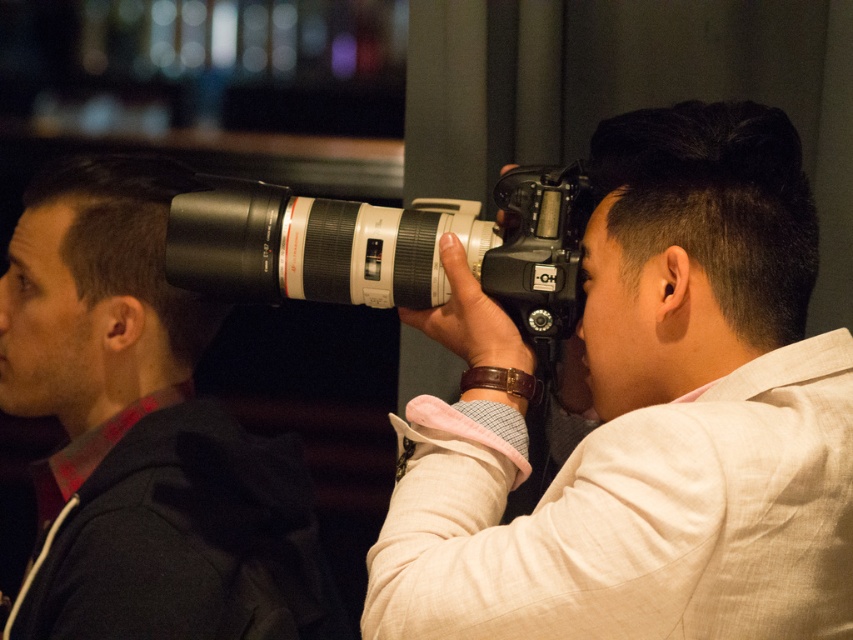
You are standing at the point labeled as point (467, 300) in the image. If you want to take a photo of the man on the right with the large telephoto lens camera, will you be able to see him clearly in your viewfinder?

The point (467, 300) and viewer are 38.44 inches apart from each other, so yes, you can see the man on the right with the large telephoto lens camera clearly in your viewfinder as the distance is within a reasonable range for clear visibility.

You are a photographer at an event and want to adjust your camera settings. You notice a point marked at coordinates (142,433). What object is located at this point?

The point at coordinates (142,433) indicates the matte black camera lens at upper left.

You are a photographer trying to organize your equipment. You have two cameras in front of you, the matte black camera at center and the black plastic camera at center. Which one is positioned to the right side?

The matte black camera at center is positioned to the right of the black plastic camera at center.